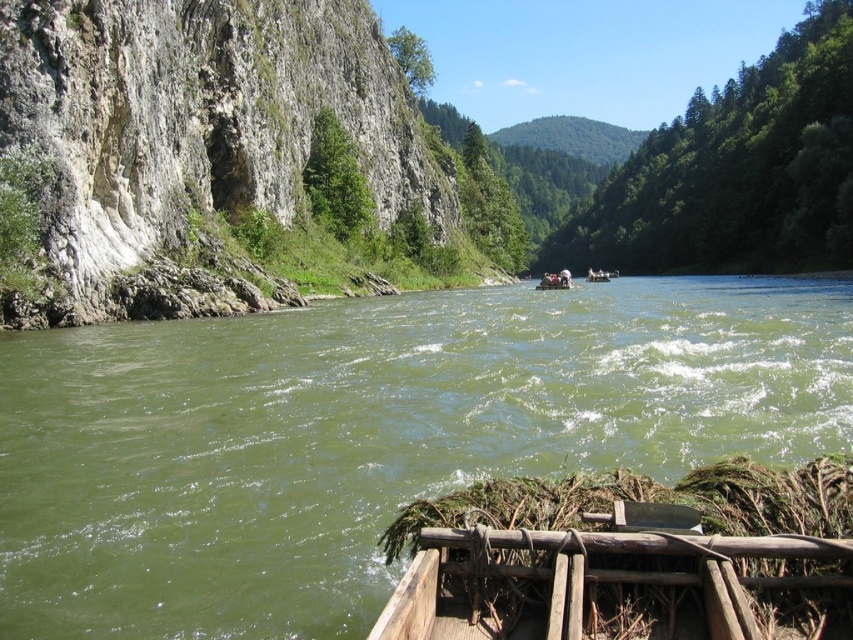
Question: Can you confirm if white rock cliff at left is positioned below wooden raft at center?

Choices:
 (A) no
 (B) yes

Answer: (A)

Question: Which of the following is the closest to the observer?

Choices:
 (A) (608, 276)
 (B) (850, 221)
 (C) (312, 433)
 (D) (1, 108)

Answer: (C)

Question: Among these points, which one is farthest from the camera?

Choices:
 (A) (94, 83)
 (B) (587, 280)

Answer: (B)

Question: Is white rock cliff at left bigger than white plastic raft at center?

Choices:
 (A) no
 (B) yes

Answer: (A)

Question: Among these objects, which one is nearest to the camera?

Choices:
 (A) greenish water at center
 (B) wooden raft at center
 (C) green leafy trees at upper center

Answer: (A)

Question: Is white rock cliff at left smaller than white plastic raft at center?

Choices:
 (A) yes
 (B) no

Answer: (A)